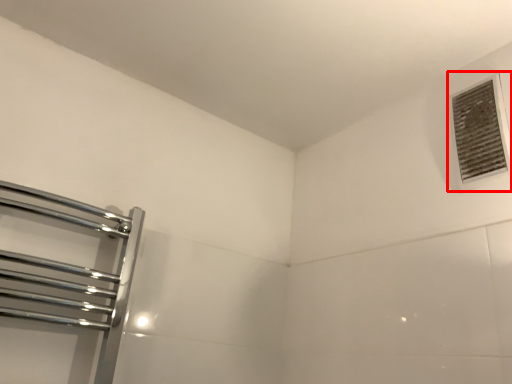
Question: From the image's perspective, considering the relative positions of air conditioning (annotated by the red box) and towel rack in the image provided, where is air conditioning (annotated by the red box) located with respect to the staircase?

Choices:
 (A) below
 (B) above

Answer: (B)